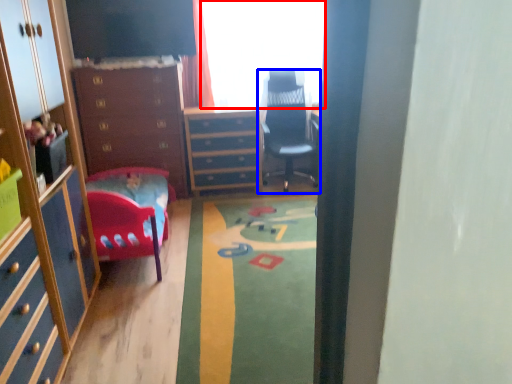
Question: Which of the following is the closest to the observer, window (highlighted by a red box) or chair (highlighted by a blue box)?

Choices:
 (A) window
 (B) chair

Answer: (B)